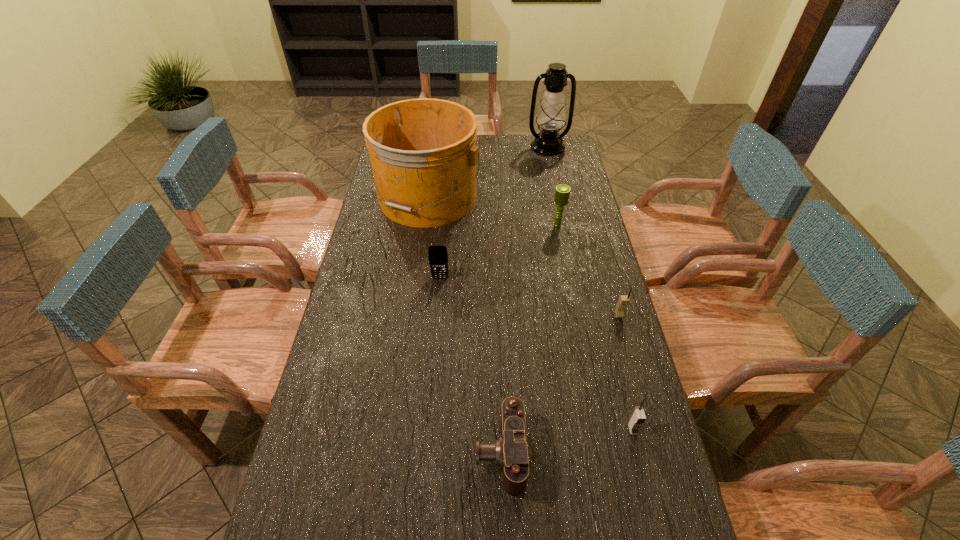
Identify the location of the farthest object. (551, 117).

Identify the location of the second tallest object. Image resolution: width=960 pixels, height=540 pixels. (423, 153).

This screenshot has width=960, height=540. What are the coordinates of `microphone` in the screenshot? It's located at (562, 192).

Image resolution: width=960 pixels, height=540 pixels. Identify the location of the fourth farthest object. (438, 257).

Locate an element on the screen. The width and height of the screenshot is (960, 540). the leftmost cellular telephone is located at coordinates (438, 257).

What are the coordinates of `the nearest cellular telephone` in the screenshot? It's located at (637, 418).

Image resolution: width=960 pixels, height=540 pixels. Identify the location of the rightmost object. tap(623, 300).

Identify the location of the rightmost cellular telephone. This screenshot has width=960, height=540. (623, 300).

This screenshot has width=960, height=540. Identify the location of camera. (510, 451).

Find the location of a particular element. free space located on the front of the oil lamp is located at coordinates (554, 178).